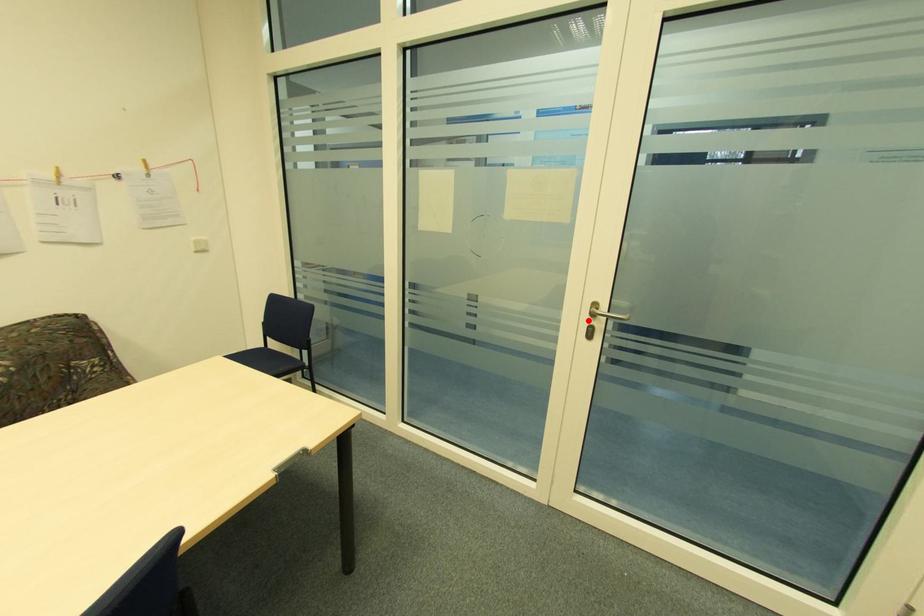
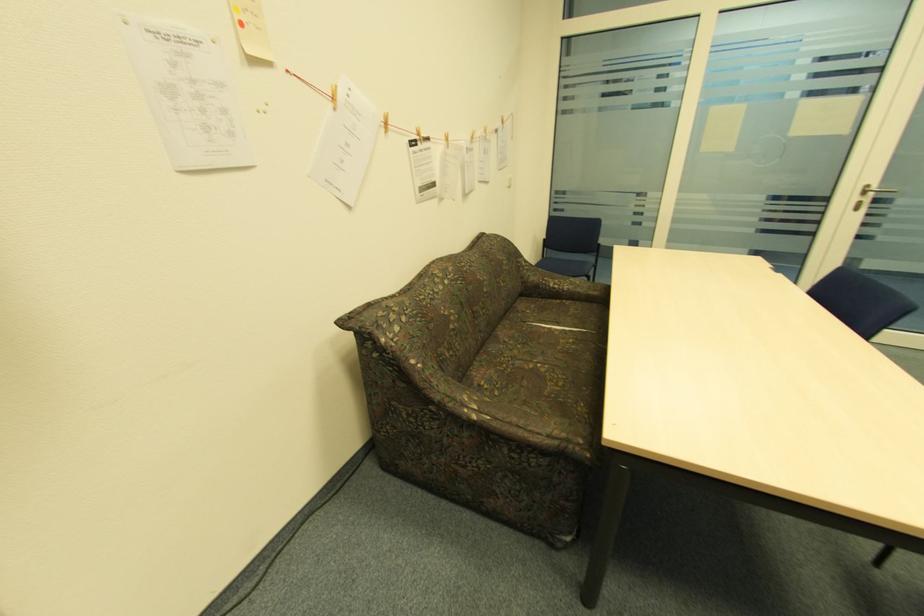
The point at the highlighted location is marked in the first image. Where is the corresponding point in the second image?

(859, 199)